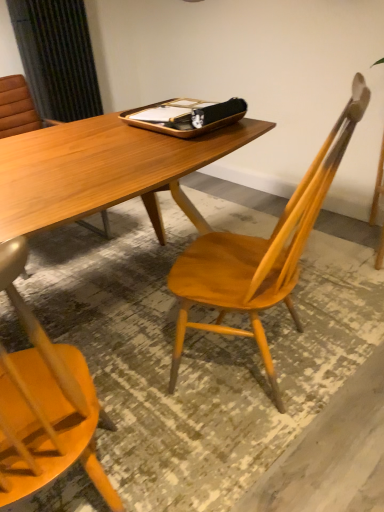
You are a GUI agent. You are given a task and a screenshot of the screen. Output one action in this format:
    pyautogui.click(x=<x>, y=<y>)
    Task: Click on the vacant area that lies to the right of wooden chair at center
    The width and height of the screenshot is (384, 512).
    Given the screenshot: What is the action you would take?
    pyautogui.click(x=345, y=320)